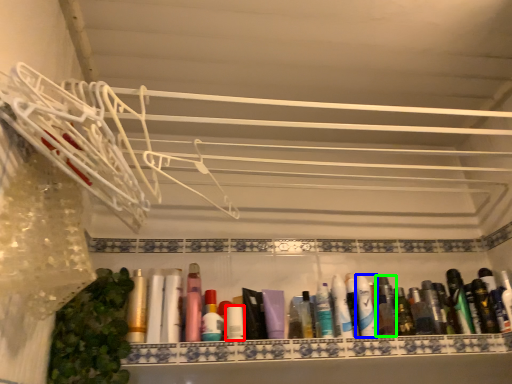
Question: Which is nearer to the toiletry (highlighted by a red box)? toothpaste (highlighted by a blue box) or toiletry (highlighted by a green box).

Choices:
 (A) toothpaste
 (B) toiletry

Answer: (A)